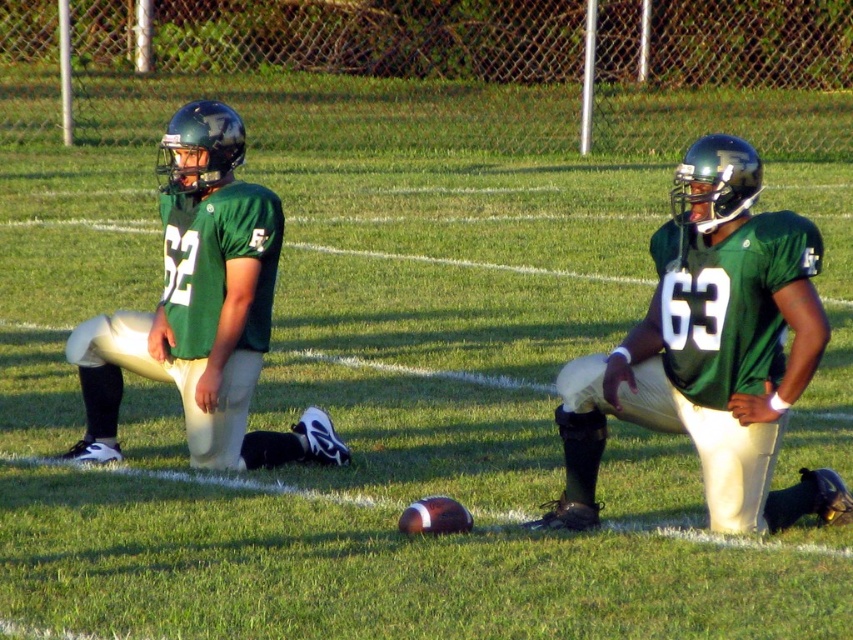
You are a referee standing at the origin point of the field. You need to determine the position of two points marked on the field. The first point is at coordinates point (788, 252) and the second is at point (186, 358). Which point is closer to you?

Point (788, 252) is in front of point (186, 358), so it is closer to you.